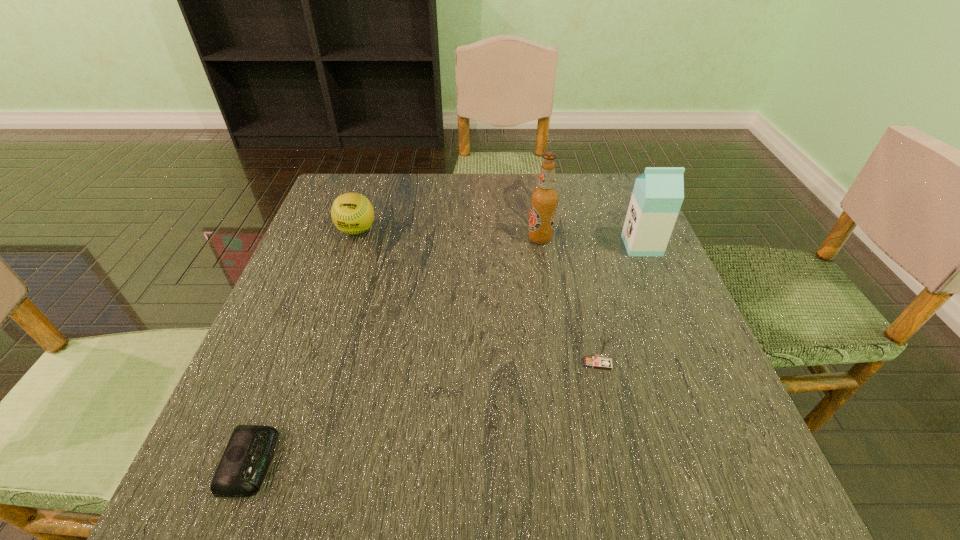
Where is `blank space located 0.240m on the front of the milk carton`? blank space located 0.240m on the front of the milk carton is located at coordinates (681, 339).

You are a GUI agent. You are given a task and a screenshot of the screen. Output one action in this format:
    pyautogui.click(x=<x>, y=<y>)
    Task: Click on the free space located on the logo side of the softball
    
    Given the screenshot: What is the action you would take?
    pyautogui.click(x=314, y=356)

The width and height of the screenshot is (960, 540). I want to click on vacant space located 0.080m on the front of the fourth object from left to right, so click(x=609, y=411).

This screenshot has width=960, height=540. What are the coordinates of `free space located on the display of the shortest object` in the screenshot? It's located at (425, 462).

Locate an element on the screen. Image resolution: width=960 pixels, height=540 pixels. object that is at the far edge is located at coordinates (352, 213).

At what (x,y) coordinates should I click in order to perform the action: click on object situated at the near edge. Please return your answer as a coordinate pair (x, y). Looking at the image, I should click on (240, 473).

Where is `softball that is at the left edge`? Image resolution: width=960 pixels, height=540 pixels. softball that is at the left edge is located at coordinates (352, 213).

Locate an element on the screen. alarm clock that is at the left edge is located at coordinates (240, 473).

This screenshot has width=960, height=540. Find the location of `object located in the right edge section of the desktop`. object located in the right edge section of the desktop is located at coordinates click(658, 193).

Where is `object at the far left corner`? object at the far left corner is located at coordinates (352, 213).